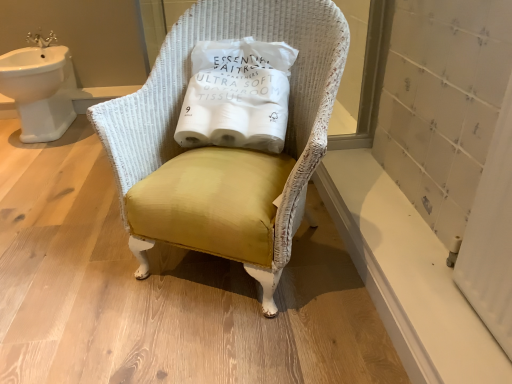
Question: Visually, is white paper toilet paper at center positioned to the left or to the right of white smooth window sill at lower right?

Choices:
 (A) right
 (B) left

Answer: (B)

Question: Considering the positions of point (192, 87) and point (411, 288), is point (192, 87) closer or farther from the camera than point (411, 288)?

Choices:
 (A) closer
 (B) farther

Answer: (B)

Question: Considering the real-world distances, which object is closest to the white paper toilet paper at center?

Choices:
 (A) white smooth window sill at lower right
 (B) mustard velvet chair at center
 (C) white ceramic sink at upper left

Answer: (B)

Question: Which object is positioned farthest from the mustard velvet chair at center?

Choices:
 (A) white smooth window sill at lower right
 (B) white ceramic sink at upper left
 (C) white paper toilet paper at center

Answer: (B)